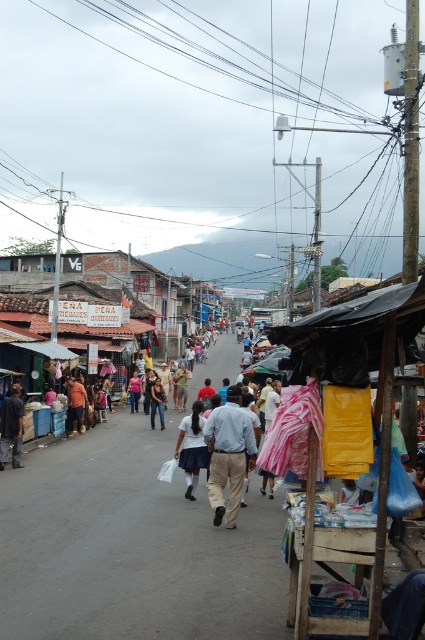
Question: Does black plastic power line at upper center have a larger size compared to dark brown leather shoes at center?

Choices:
 (A) no
 (B) yes

Answer: (B)

Question: Considering the relative positions of light blue shirt at center and white matte skirt at center in the image provided, where is light blue shirt at center located with respect to white matte skirt at center?

Choices:
 (A) below
 (B) above

Answer: (B)

Question: Can you confirm if black plastic power line at upper center is positioned to the right of white matte skirt at center?

Choices:
 (A) no
 (B) yes

Answer: (B)

Question: Which of the following is the farthest from the observer?

Choices:
 (A) light blue shirt at center
 (B) white matte skirt at center
 (C) dark brown leather shoes at center

Answer: (C)

Question: Which of the following is the farthest from the observer?

Choices:
 (A) dark brown leather shoes at center
 (B) light blue shirt at center

Answer: (A)

Question: Based on their relative distances, which object is farther from the dark blue dress at center?

Choices:
 (A) dark brown leather shoes at center
 (B) white matte skirt at center

Answer: (B)